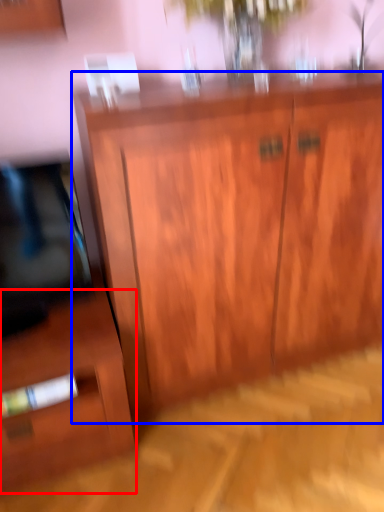
Question: Which object appears farthest to the camera in this image, side cabinet (highlighted by a red box) or cupboard (highlighted by a blue box)?

Choices:
 (A) side cabinet
 (B) cupboard

Answer: (A)